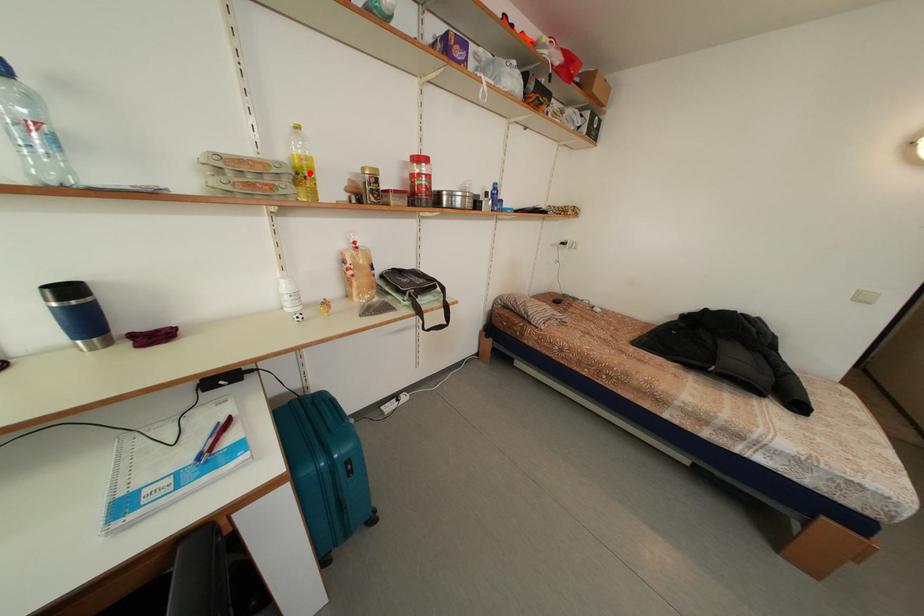
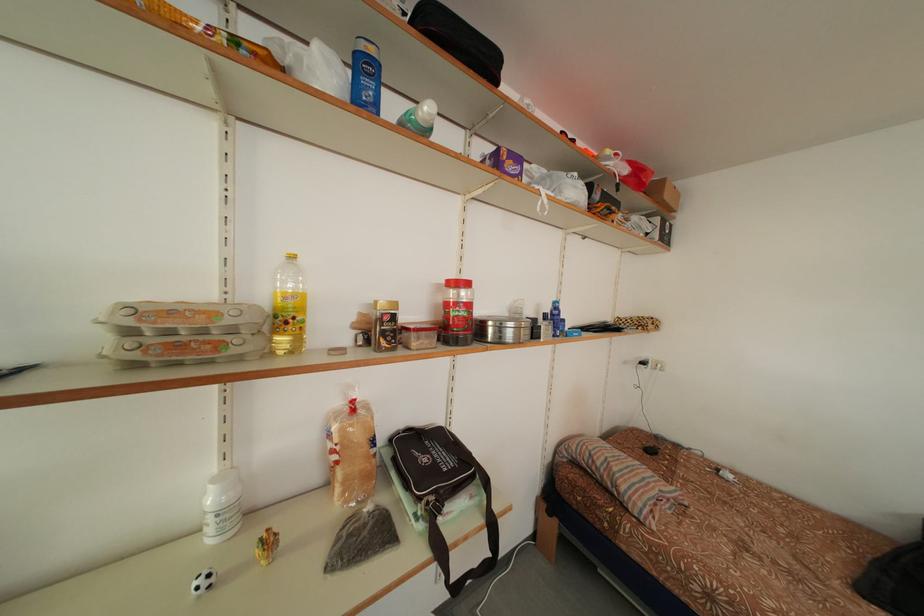
In the second image, find the point that corresponds to the highlighted location in the first image.

(292, 314)